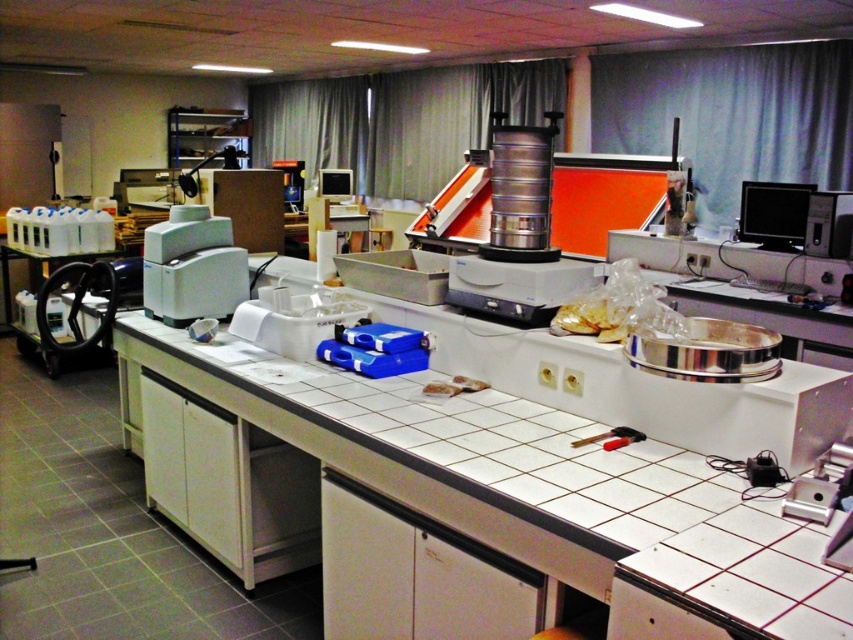
You are a technician who needs to move a 10 feet long cable from the white plastic printer at left to the matte black monitor at upper right. Can you connect them without needing an extension cord?

The distance between the white plastic printer at left and the matte black monitor at upper right is 9.77 feet, so the 10 feet cable is long enough to connect them without needing an extension cord.